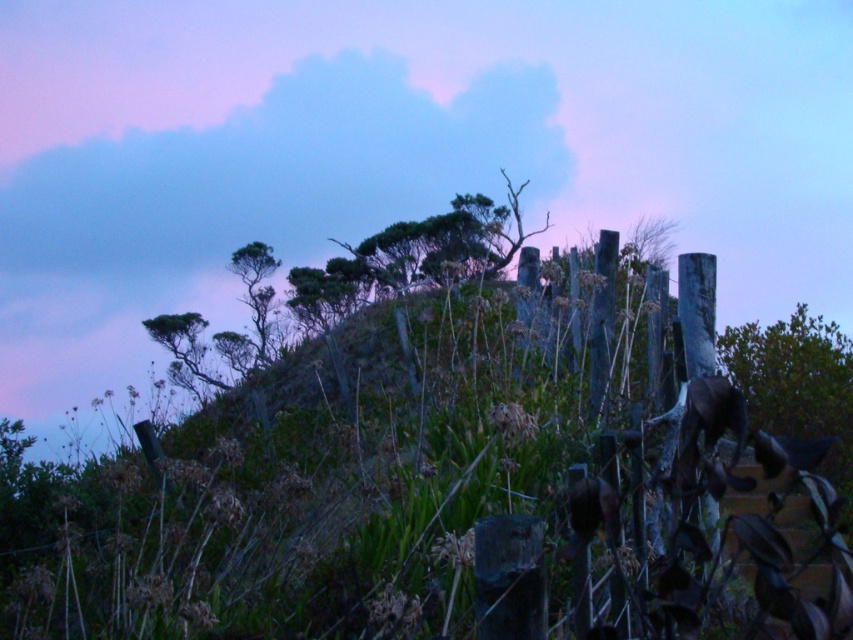
Question: Does green matte tree at right appear over green leafy tree at center?

Choices:
 (A) no
 (B) yes

Answer: (A)

Question: Which point is farther from the camera taking this photo?

Choices:
 (A) (805, 349)
 (B) (271, 301)
 (C) (207, 380)

Answer: (B)

Question: Which of these objects is positioned farthest from the green leafy tree at upper center?

Choices:
 (A) green matte tree at right
 (B) green leafy tree at center

Answer: (A)

Question: Can you confirm if green leafy tree at center is positioned to the right of green leafy tree at upper center?

Choices:
 (A) yes
 (B) no

Answer: (B)

Question: Can you confirm if green matte tree at right is positioned above green leafy tree at center?

Choices:
 (A) yes
 (B) no

Answer: (B)

Question: Which object is positioned farthest from the green matte tree at right?

Choices:
 (A) green leafy tree at upper center
 (B) green leafy tree at center

Answer: (B)